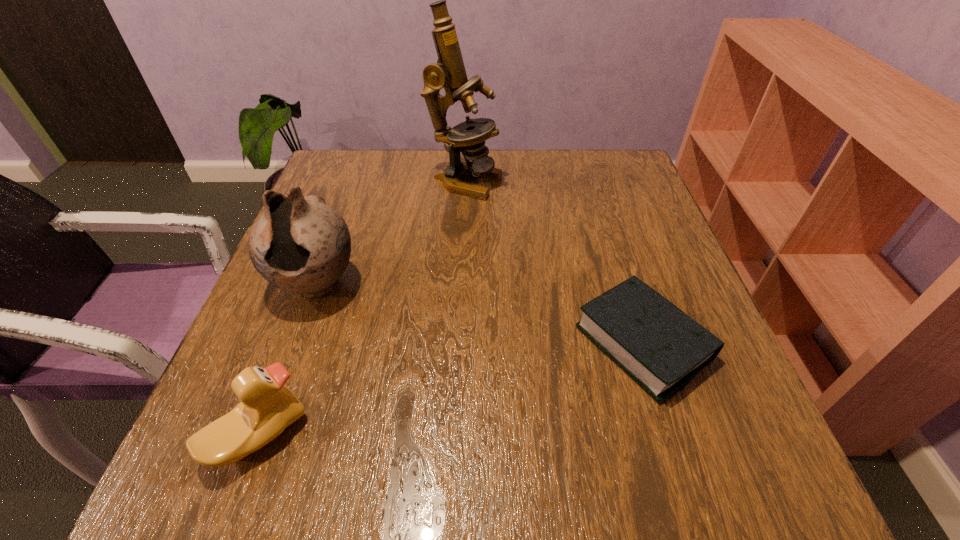
Locate an element on the screen. object present at the far edge is located at coordinates (468, 137).

Identify the location of object at the near edge. Image resolution: width=960 pixels, height=540 pixels. (267, 407).

Where is `pottery located at the left edge`? This screenshot has height=540, width=960. pottery located at the left edge is located at coordinates (299, 244).

Locate an element on the screen. duck that is positioned at the left edge is located at coordinates (267, 407).

This screenshot has height=540, width=960. I want to click on object located in the right edge section of the desktop, so pyautogui.click(x=658, y=345).

Identify the location of object that is at the near left corner. (267, 407).

Where is `vacant area at the far edge of the desktop`? vacant area at the far edge of the desktop is located at coordinates (411, 161).

Where is `vacant space at the near edge of the desktop`? The image size is (960, 540). vacant space at the near edge of the desktop is located at coordinates (304, 464).

The image size is (960, 540). In order to click on free region at the left edge of the desktop in this screenshot , I will do `click(301, 369)`.

Image resolution: width=960 pixels, height=540 pixels. In order to click on vacant space at the right edge of the desktop in this screenshot , I will do `click(663, 229)`.